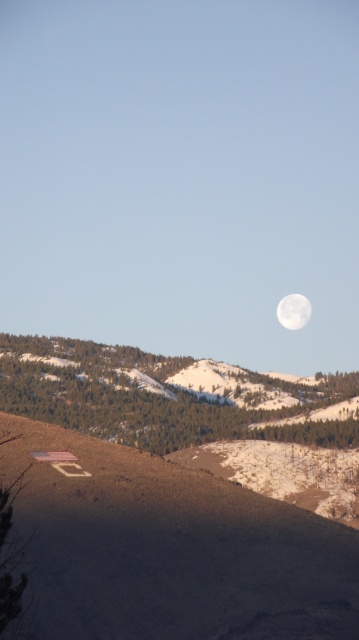
Question: Is brown dirt at lower left above white glossy moon at upper center?

Choices:
 (A) no
 (B) yes

Answer: (A)

Question: Considering the relative positions of brown dirt at lower left and white glossy moon at upper center in the image provided, where is brown dirt at lower left located with respect to white glossy moon at upper center?

Choices:
 (A) left
 (B) right

Answer: (A)

Question: Which of the following is the farthest from the observer?

Choices:
 (A) (226, 557)
 (B) (292, 314)

Answer: (B)

Question: Is brown dirt at lower left positioned behind white glossy moon at upper center?

Choices:
 (A) yes
 (B) no

Answer: (B)